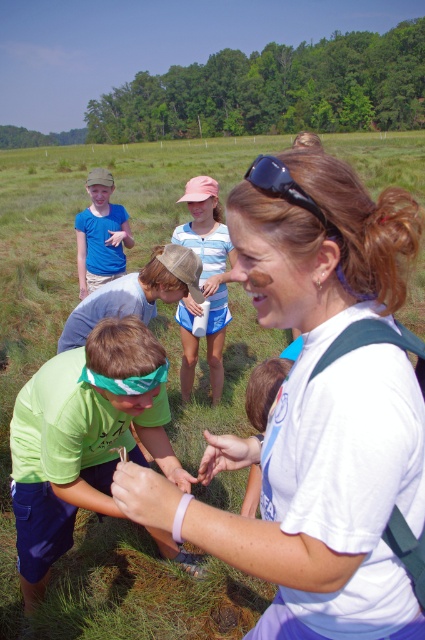
You are a photographer trying to capture a clear shot of the pink fabric cap at upper center and the black rubber sunglasses at upper center. Since both are at the same position, which one might be more visible in your photo?

The pink fabric cap at upper center is more visible because the black rubber sunglasses at upper center is behind it.

You are standing at the center of the image. There is a point marked at coordinates [84,438]. What object is located at this point?

The point at coordinates [84,438] indicates the green fabric headband at lower left.